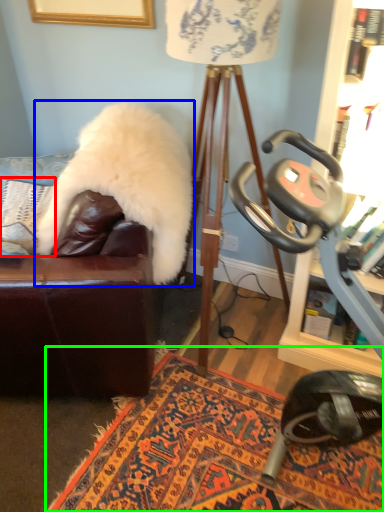
Question: Considering the real-world distances, which object is closest to pillow (highlighted by a red box)? fur coat (highlighted by a blue box) or mat (highlighted by a green box).

Choices:
 (A) fur coat
 (B) mat

Answer: (A)